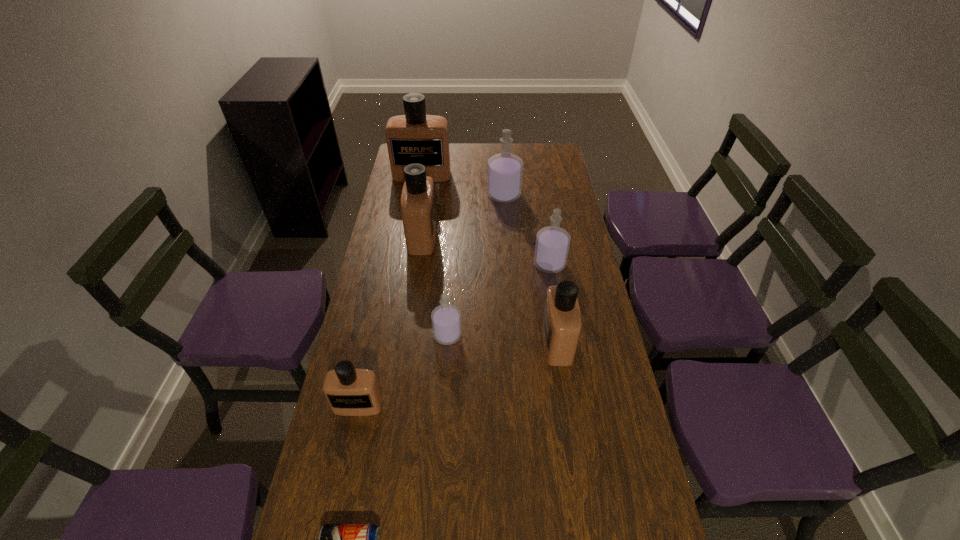
At what (x,y) coordinates should I click in order to perform the action: click on the biggest beige perfume. Please return your answer as a coordinate pair (x, y). The image size is (960, 540). Looking at the image, I should click on (415, 137).

You are a GUI agent. You are given a task and a screenshot of the screen. Output one action in this format:
    pyautogui.click(x=<x>, y=<y>)
    Task: Click on the tallest perfume
    
    Given the screenshot: What is the action you would take?
    pyautogui.click(x=415, y=137)

Identify the location of the third smallest beige perfume. (418, 209).

Locate an element on the screen. the fifth perfume from left to right is located at coordinates (504, 177).

This screenshot has height=540, width=960. In order to click on the biggest purple perfume in this screenshot , I will do `click(504, 177)`.

The image size is (960, 540). What are the coordinates of `the rightmost purple perfume` in the screenshot? It's located at (552, 245).

The height and width of the screenshot is (540, 960). Find the location of `the second nearest purple perfume`. the second nearest purple perfume is located at coordinates (552, 245).

The width and height of the screenshot is (960, 540). I want to click on the second smallest beige perfume, so click(x=561, y=326).

The width and height of the screenshot is (960, 540). In order to click on the second nearest beige perfume in this screenshot , I will do `click(561, 326)`.

Find the location of a particular element. The image size is (960, 540). the nearest purple perfume is located at coordinates pyautogui.click(x=446, y=319).